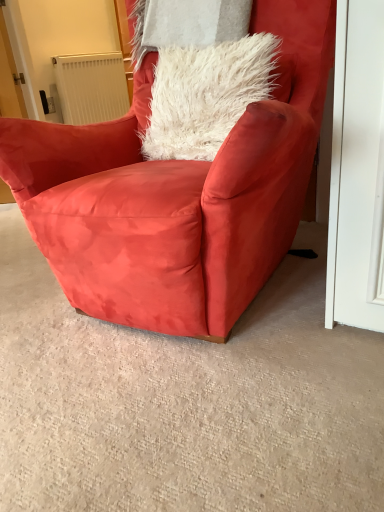
Describe the element at coordinates (91, 87) in the screenshot. The height and width of the screenshot is (512, 384). I see `white plastic radiator at upper left` at that location.

Locate an element on the screen. white plastic radiator at upper left is located at coordinates 91,87.

Describe the element at coordinates (177, 194) in the screenshot. This screenshot has height=512, width=384. I see `suede red armchair at center` at that location.

This screenshot has height=512, width=384. Identify the location of suede red armchair at center. (177, 194).

I want to click on white plastic radiator at upper left, so click(91, 87).

Between suede red armchair at center and white plastic radiator at upper left, which one appears on the right side from the viewer's perspective?

From the viewer's perspective, suede red armchair at center appears more on the right side.

Is suede red armchair at center closer to camera compared to white plastic radiator at upper left?

Yes.

Which point is more forward, (320, 26) or (85, 89)?

The point (320, 26) is closer.

From the image's perspective, between suede red armchair at center and white plastic radiator at upper left, who is located below?

suede red armchair at center.

From a real-world perspective, who is located higher, suede red armchair at center or white plastic radiator at upper left?

From a 3D spatial view, white plastic radiator at upper left is above.

Considering the relative sizes of suede red armchair at center and white plastic radiator at upper left in the image provided, is suede red armchair at center wider than white plastic radiator at upper left?

Correct, the width of suede red armchair at center exceeds that of white plastic radiator at upper left.

Considering the sizes of suede red armchair at center and white plastic radiator at upper left in the image, is suede red armchair at center taller or shorter than white plastic radiator at upper left?

suede red armchair at center is taller than white plastic radiator at upper left.

Which of these two, suede red armchair at center or white plastic radiator at upper left, is smaller?

Smaller between the two is white plastic radiator at upper left.

Is suede red armchair at center positioned beyond the bounds of white plastic radiator at upper left?

Yes, suede red armchair at center is not within white plastic radiator at upper left.

Is suede red armchair at center not near white plastic radiator at upper left?

Yes, suede red armchair at center and white plastic radiator at upper left are quite far apart.

Is suede red armchair at center positioned with its back to white plastic radiator at upper left?

suede red armchair at center is not turned away from white plastic radiator at upper left.

Can you tell me how much suede red armchair at center and white plastic radiator at upper left differ in facing direction?

The angular difference between suede red armchair at center and white plastic radiator at upper left is 94.1 degrees.

Where is `radiator that appears on the left of suede red armchair at center`? radiator that appears on the left of suede red armchair at center is located at coordinates (91, 87).

Is white plastic radiator at upper left to the left of suede red armchair at center from the viewer's perspective?

Indeed, white plastic radiator at upper left is positioned on the left side of suede red armchair at center.

Which object is closer to the camera, white plastic radiator at upper left or suede red armchair at center?

suede red armchair at center.

Considering the positions of point (76, 119) and point (291, 94), is point (76, 119) closer or farther from the camera than point (291, 94)?

Clearly, point (76, 119) is more distant from the camera than point (291, 94).

From the image's perspective, does white plastic radiator at upper left appear lower than suede red armchair at center?

Incorrect, from the image's perspective, white plastic radiator at upper left is higher than suede red armchair at center.

From a real-world perspective, which is physically above, white plastic radiator at upper left or suede red armchair at center?

white plastic radiator at upper left is physically above.

Which object is thinner, white plastic radiator at upper left or suede red armchair at center?

With smaller width is white plastic radiator at upper left.

Is white plastic radiator at upper left taller than suede red armchair at center?

Incorrect, the height of white plastic radiator at upper left is not larger of that of suede red armchair at center.

Does white plastic radiator at upper left have a larger size compared to suede red armchair at center?

Actually, white plastic radiator at upper left might be smaller than suede red armchair at center.

Would you say white plastic radiator at upper left is inside or outside suede red armchair at center?

white plastic radiator at upper left cannot be found inside suede red armchair at center.

Is white plastic radiator at upper left directly adjacent to suede red armchair at center?

They are not placed beside each other.

Is white plastic radiator at upper left facing towards suede red armchair at center?

No.

How distant is white plastic radiator at upper left from suede red armchair at center?

white plastic radiator at upper left is 5.00 feet away from suede red armchair at center.

Where is `chair on the right of white plastic radiator at upper left`? chair on the right of white plastic radiator at upper left is located at coordinates (177, 194).

Identify the location of chair below the white plastic radiator at upper left (from a real-world perspective). (177, 194).

Image resolution: width=384 pixels, height=512 pixels. Identify the location of radiator above the suede red armchair at center (from a real-world perspective). (91, 87).